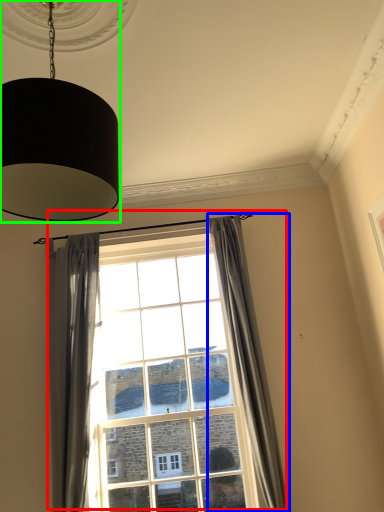
Question: Which is farther away from window (highlighted by a red box)? curtain (highlighted by a blue box) or lamp (highlighted by a green box)?

Choices:
 (A) curtain
 (B) lamp

Answer: (B)